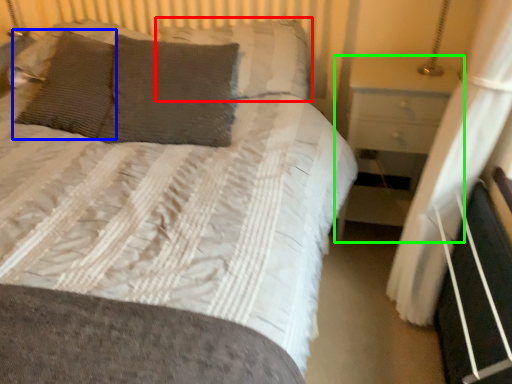
Question: Which object is the closest to the pillow (highlighted by a red box)? Choose among these: pillow (highlighted by a blue box) or nightstand (highlighted by a green box).

Choices:
 (A) pillow
 (B) nightstand

Answer: (B)